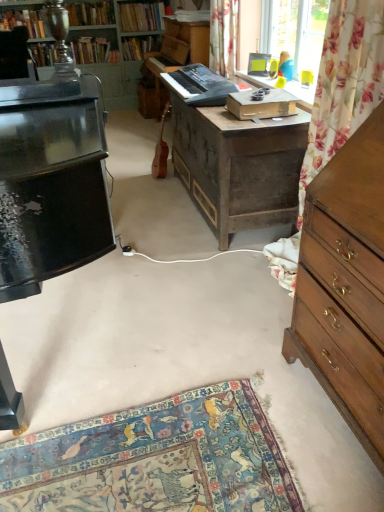
Locate an element on the screen. The height and width of the screenshot is (512, 384). free space below black glossy piano at left, acting as the third piano starting from the back (from a real-world perspective) is located at coordinates point(57,336).